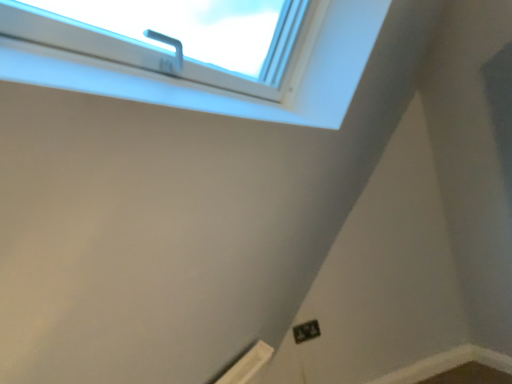
What is the approximate height of black plastic electric outlet at lower right?

It is 3.15 inches.

Locate an element on the screen. black plastic electric outlet at lower right is located at coordinates (306, 331).

The width and height of the screenshot is (512, 384). Describe the element at coordinates (306, 331) in the screenshot. I see `black plastic electric outlet at lower right` at that location.

Locate an element on the screen. black plastic electric outlet at lower right is located at coordinates (306, 331).